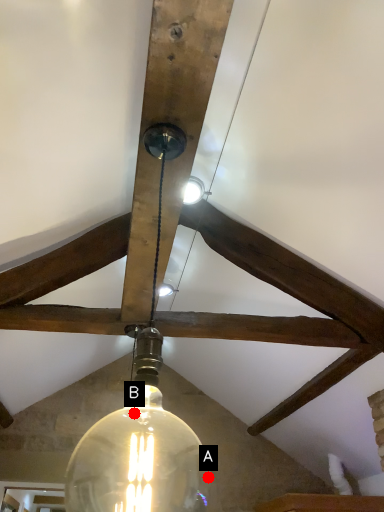
Question: Two points are circled on the image, labeled by A and B beside each circle. Which point is farther to the camera?

Choices:
 (A) A is further
 (B) B is further

Answer: (A)